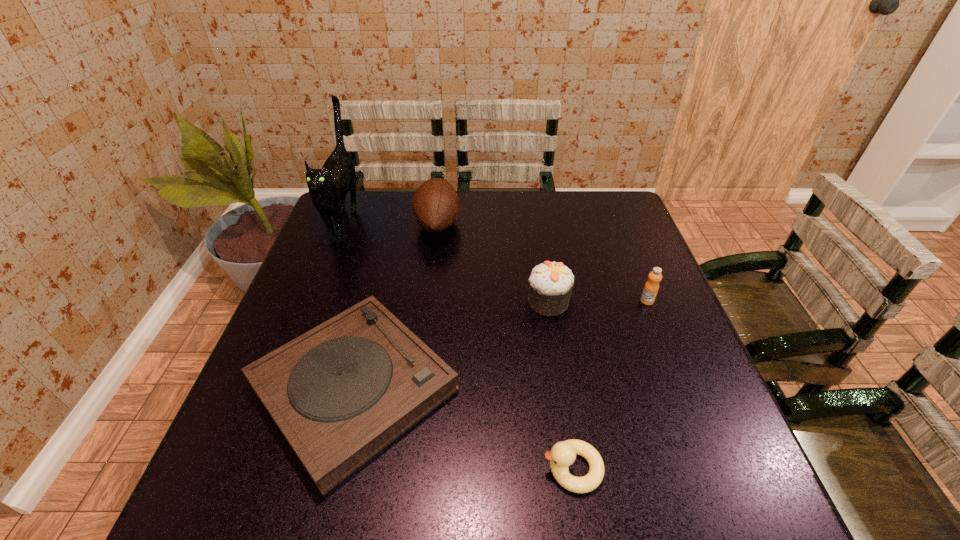
The image size is (960, 540). I want to click on object present at the right edge, so click(x=651, y=287).

Find the location of `object that is at the far left corner`. object that is at the far left corner is located at coordinates [328, 187].

Image resolution: width=960 pixels, height=540 pixels. Find the location of `object situated at the near left corner`. object situated at the near left corner is located at coordinates (340, 393).

In the image, there is a desktop. Identify the location of free space at the far edge. The width and height of the screenshot is (960, 540). (471, 209).

Find the location of a particular element. free space at the near edge is located at coordinates pos(417,483).

The width and height of the screenshot is (960, 540). Find the location of `vacant area at the left edge`. vacant area at the left edge is located at coordinates (250, 455).

Locate an element on the screen. free space at the right edge of the desktop is located at coordinates (629, 312).

The image size is (960, 540). In the image, there is a desktop. Find the location of `blank space at the near right corner`. blank space at the near right corner is located at coordinates (716, 516).

You are a GUI agent. You are given a task and a screenshot of the screen. Output one action in this format:
    pyautogui.click(x=<x>, y=<y>)
    Task: Click on the free spot between the duckling and the orange juice
    The height and width of the screenshot is (540, 960).
    Given the screenshot: What is the action you would take?
    pyautogui.click(x=610, y=384)

The height and width of the screenshot is (540, 960). Find the location of `unoccupied area between the orange juice and the second tallest object`. unoccupied area between the orange juice and the second tallest object is located at coordinates (542, 262).